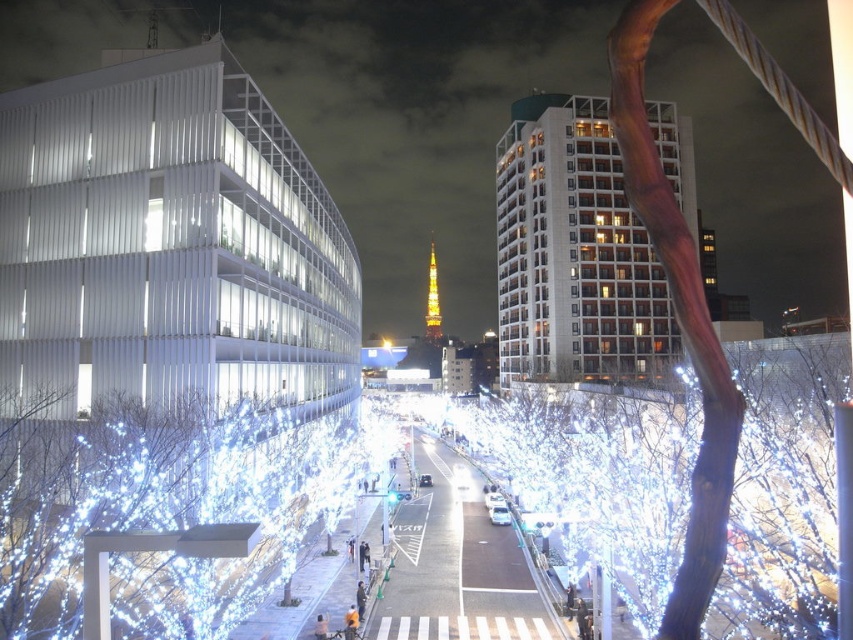
Which of these two, illuminated white branches at center or illuminated white branches at lower left, stands taller?

illuminated white branches at center is taller.

Between illuminated white branches at center and illuminated white branches at lower left, which one is positioned higher?

Positioned higher is illuminated white branches at center.

Who is more distant from viewer, (x=602, y=528) or (x=39, y=464)?

Point (x=602, y=528)

The image size is (853, 640). In order to click on illuminated white branches at center in this screenshot , I will do `click(784, 486)`.